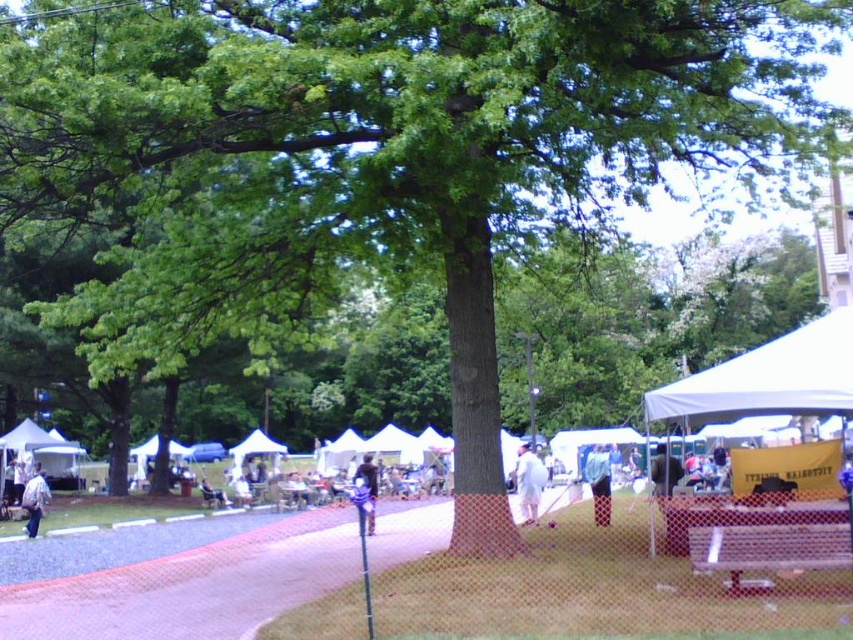
You are standing at the event and see both the white canvas tent at lower left and the light blue denim jacket at lower left. Which object is closer to you?

The white canvas tent at lower left is closer to you because it is further to the viewer than the light blue denim jacket at lower left.

Consider the image. You are organizing a small event and need to decide which item to place first in the setup area. Considering the white canvas tent at lower left and the light blue denim jacket at lower left, which one has a larger width and should be placed first to accommodate space?

The light blue denim jacket at lower left has a larger width than the white canvas tent at lower left, so it should be placed first to ensure there is enough space.